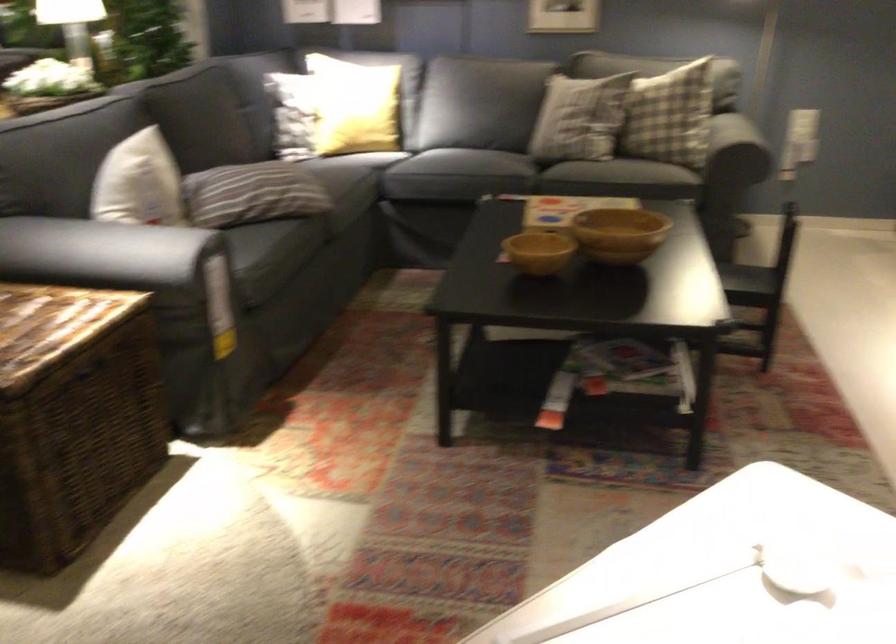
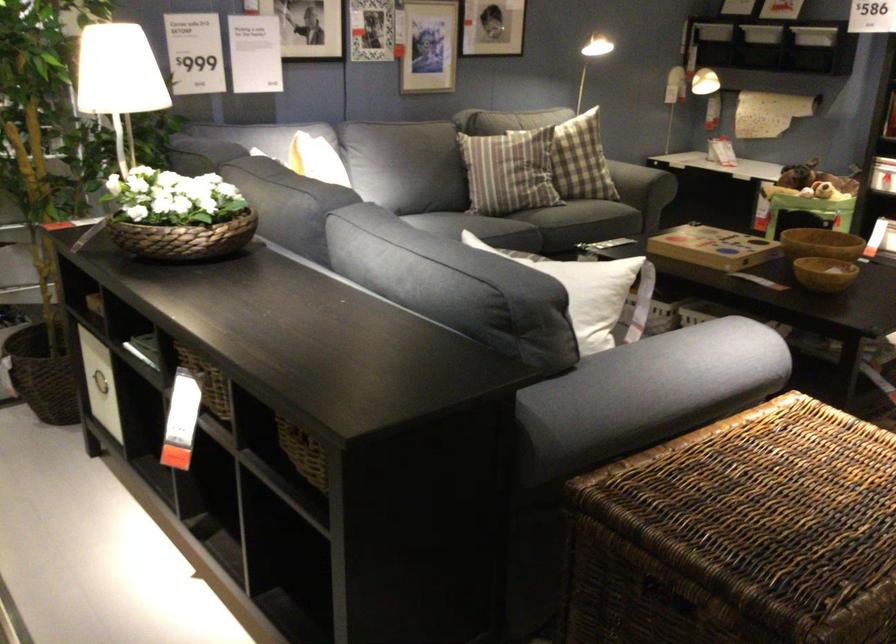
The point at (513, 95) is marked in the first image. Where is the corresponding point in the second image?

(507, 172)